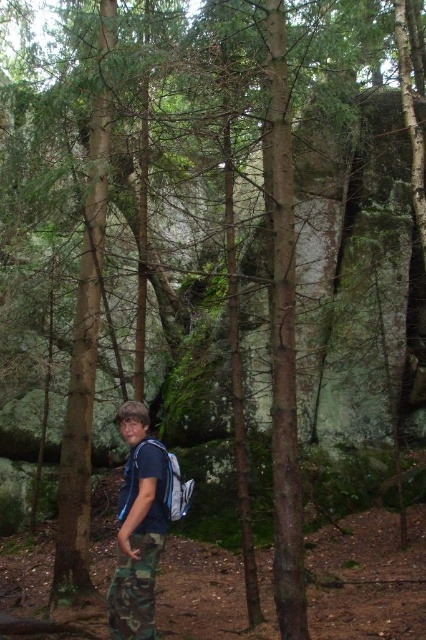
Question: Which of these objects is positioned farthest from the camouflage pants at lower center?

Choices:
 (A) camo pants at center
 (B) matte blue backpack at center

Answer: (B)

Question: Which object is farther from the camera taking this photo?

Choices:
 (A) matte blue backpack at center
 (B) camouflage pants at lower center

Answer: (A)

Question: Among these points, which one is nearest to the camera?

Choices:
 (A) (129, 596)
 (B) (172, 499)

Answer: (A)

Question: Does camo pants at center lie in front of matte blue backpack at center?

Choices:
 (A) no
 (B) yes

Answer: (B)

Question: Can you confirm if camo pants at center is thinner than matte blue backpack at center?

Choices:
 (A) no
 (B) yes

Answer: (A)

Question: Is camo pants at center smaller than camouflage pants at lower center?

Choices:
 (A) no
 (B) yes

Answer: (A)